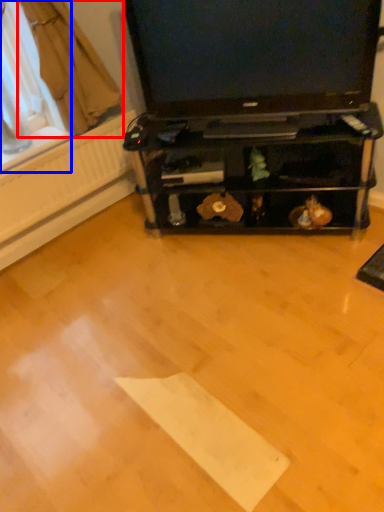
Question: Among these objects, which one is nearest to the camera, curtain (highlighted by a red box) or window screen (highlighted by a blue box)?

Choices:
 (A) curtain
 (B) window screen

Answer: (A)